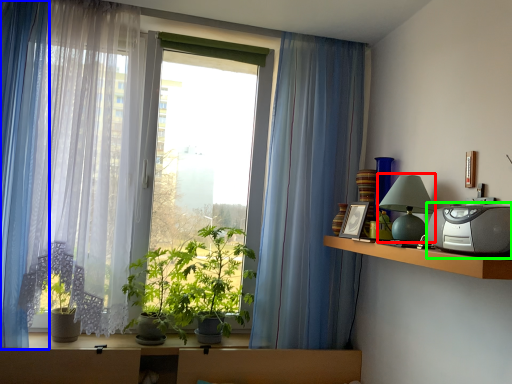
Question: Which is nearer to the table lamp (highlighted by a red box)? curtain (highlighted by a blue box) or appliance (highlighted by a green box).

Choices:
 (A) curtain
 (B) appliance

Answer: (B)